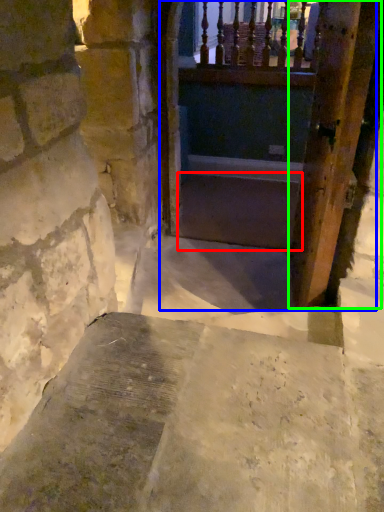
Question: Based on their relative distances, which object is nearer to stairs (highlighted by a red box)? Choose from tunnel (highlighted by a blue box) and door (highlighted by a green box).

Choices:
 (A) tunnel
 (B) door

Answer: (A)